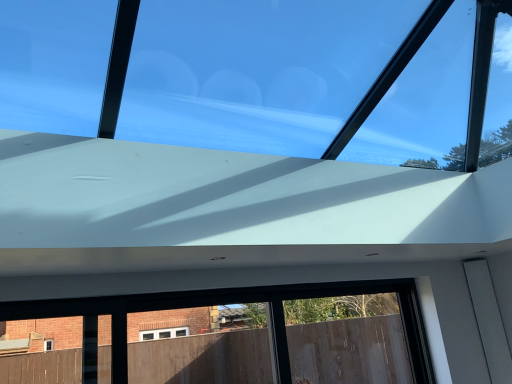
Describe the element at coordinates (324, 80) in the screenshot. The image size is (512, 384). I see `transparent glass window at upper center` at that location.

This screenshot has width=512, height=384. In order to click on transparent glass window at upper center in this screenshot , I will do `click(324, 80)`.

The image size is (512, 384). I want to click on transparent glass window at upper center, so click(x=324, y=80).